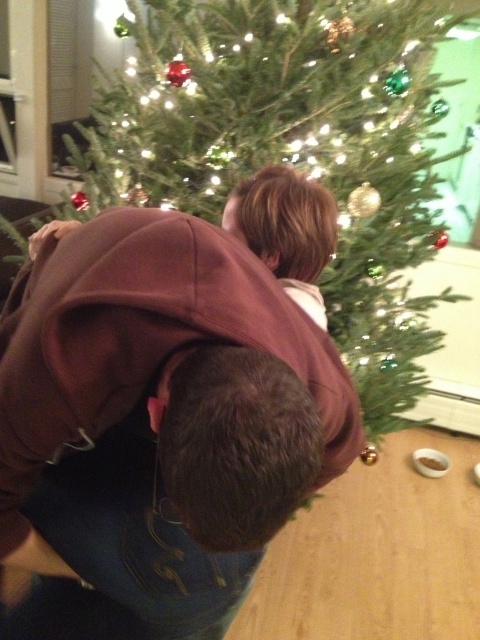
You are at the bottom of a slide in a playground and want to climb up to the top. There is a brown hoodie at center and a green matte christmas tree at center in your way. Which one do you need to move to reach the top?

The brown hoodie at center is located below the green matte christmas tree at center, so you need to move the brown hoodie at center first to reach the top.

You are a guest at a Christmas party and want to take a photo of the brown hoodie at center and the green matte christmas tree at center together in the frame. Which object should you focus on first to ensure both are in the shot?

The brown hoodie at center has a smaller size compared to the green matte christmas tree at center, so you should focus on the green matte christmas tree at center first to ensure both are in the frame.

You are planning to take a photo of the green matte christmas tree at center and the brown hoodie at center. Since you want both subjects to be fully visible in the frame, which one should you focus on first to ensure proper framing?

The brown hoodie at center has a lesser height compared to the green matte christmas tree at center, so you should focus on the green matte christmas tree at center first to ensure it fits properly in the frame.